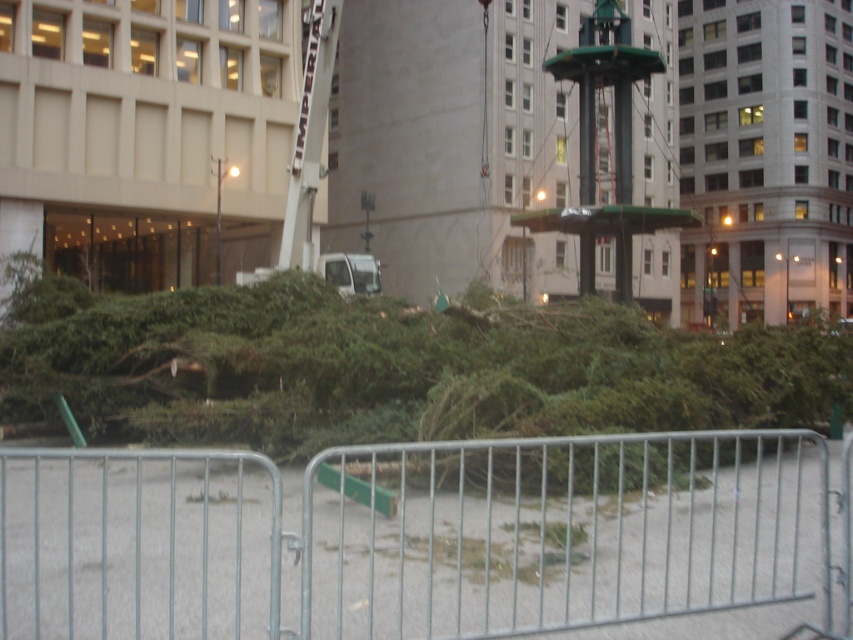
Question: Is metal at center to the right of green leafy tree at center from the viewer's perspective?

Choices:
 (A) no
 (B) yes

Answer: (B)

Question: Can you confirm if metal at center is thinner than green leafy tree at center?

Choices:
 (A) yes
 (B) no

Answer: (A)

Question: Among these objects, which one is nearest to the camera?

Choices:
 (A) metal at center
 (B) green leafy tree at center

Answer: (B)

Question: Which point is closer to the camera?

Choices:
 (A) (549, 449)
 (B) (602, 337)

Answer: (A)

Question: Does metal at center appear under green leafy tree at center?

Choices:
 (A) no
 (B) yes

Answer: (B)

Question: Which point is closer to the camera?

Choices:
 (A) (262, 500)
 (B) (393, 316)

Answer: (A)